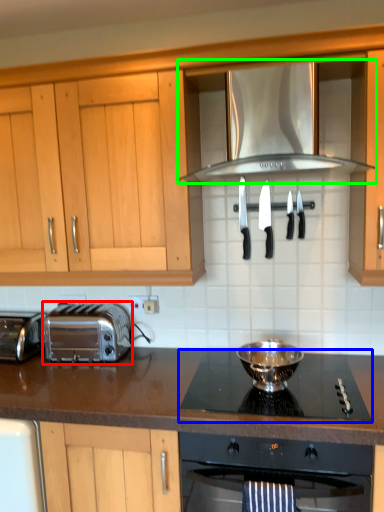
Question: Which object is the farthest from toaster (highlighted by a red box)? Choose among these: gas stove (highlighted by a blue box) or exhaust hood (highlighted by a green box).

Choices:
 (A) gas stove
 (B) exhaust hood

Answer: (B)